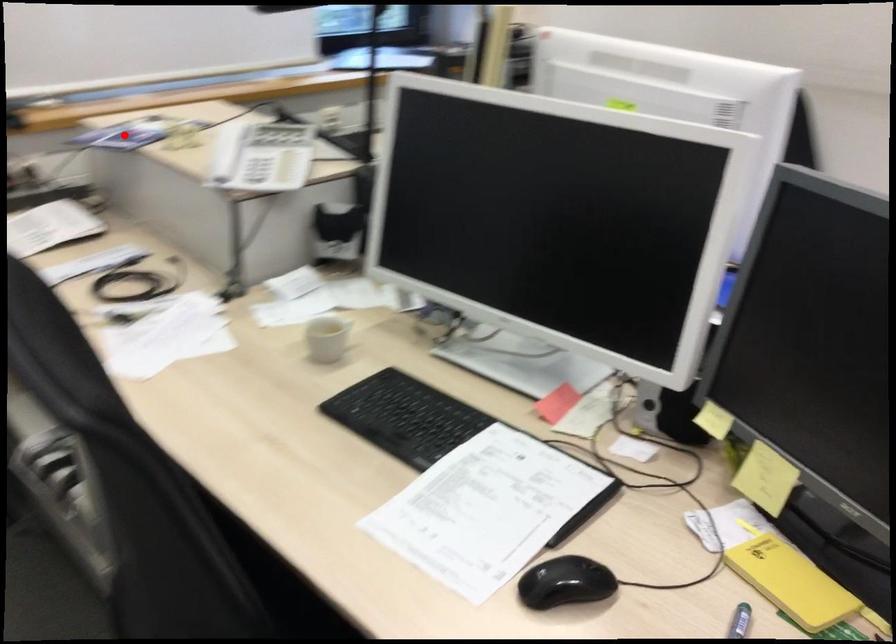
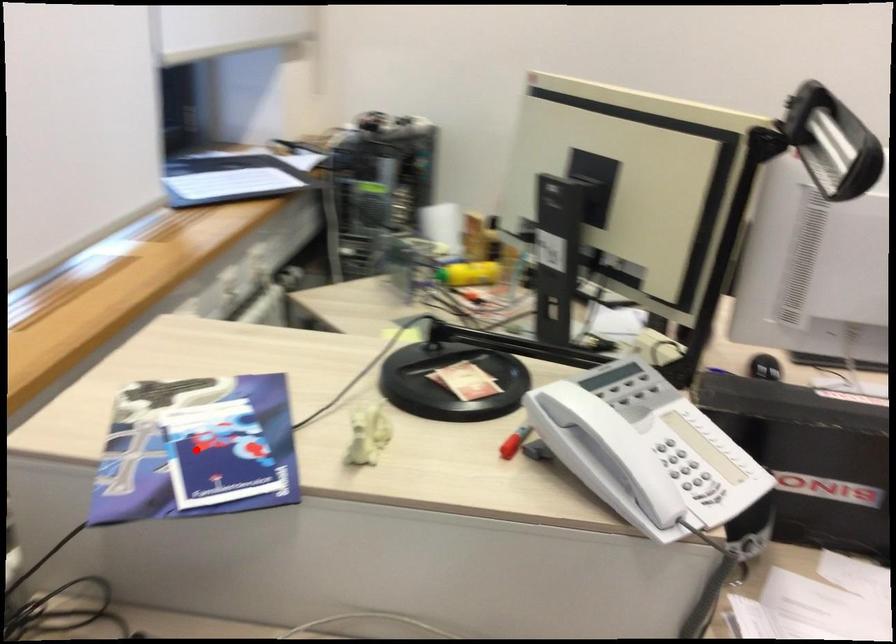
I am providing you with two images of the same scene from different viewpoints. A red point is marked on the first image and another point is marked on the second image. Do the highlighted points in image1 and image2 indicate the same real-world spot?

Yes